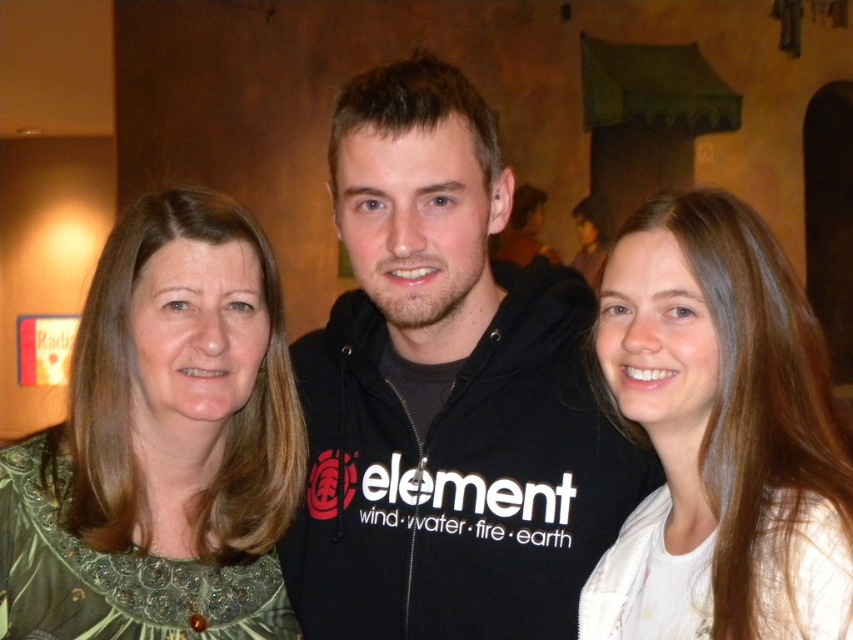
Is green sequined dress at left above smooth white shirt at right?

Actually, green sequined dress at left is below smooth white shirt at right.

This screenshot has height=640, width=853. Find the location of `green sequined dress at left`. green sequined dress at left is located at coordinates (158, 451).

Which is in front, point (589, 324) or point (753, 477)?

Point (753, 477) is in front.

You are a GUI agent. You are given a task and a screenshot of the screen. Output one action in this format:
    pyautogui.click(x=<x>, y=<y>)
    Task: Click on the black hoodie at center
    The width and height of the screenshot is (853, 640).
    Given the screenshot: What is the action you would take?
    pyautogui.click(x=445, y=392)

Measure the distance between point (485, 449) and camera.

Point (485, 449) is 4.33 feet away from camera.

Find the location of a particular element. This screenshot has height=640, width=853. black hoodie at center is located at coordinates (445, 392).

Between black hoodie at center and green sequined dress at left, which one has less height?

green sequined dress at left is shorter.

Is black hoodie at center behind green sequined dress at left?

No, it is not.

The height and width of the screenshot is (640, 853). I want to click on black hoodie at center, so click(x=445, y=392).

Identify the location of black hoodie at center. The width and height of the screenshot is (853, 640). (445, 392).